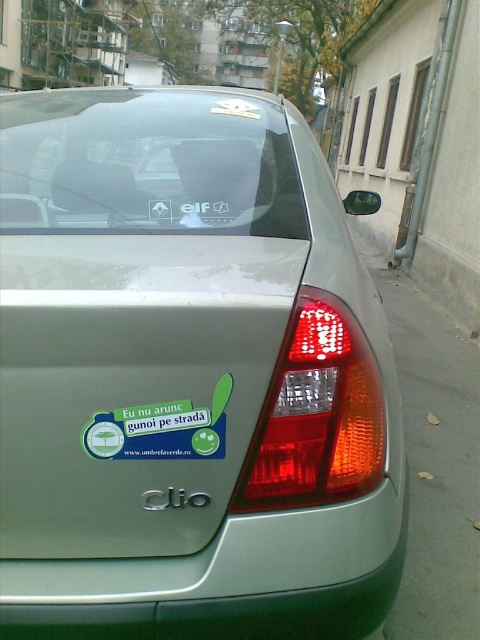
Image resolution: width=480 pixels, height=640 pixels. Describe the element at coordinates (189, 376) in the screenshot. I see `satin silver car at center` at that location.

Based on the photo, does satin silver car at center appear on the left side of green sticker at center?

No, satin silver car at center is not to the left of green sticker at center.

Is point (276, 451) farther from camera compared to point (148, 410)?

Yes, it is.

At what (x,y) coordinates should I click in order to perform the action: click on satin silver car at center. Please return your answer as a coordinate pair (x, y). The image size is (480, 640). Looking at the image, I should click on point(189,376).